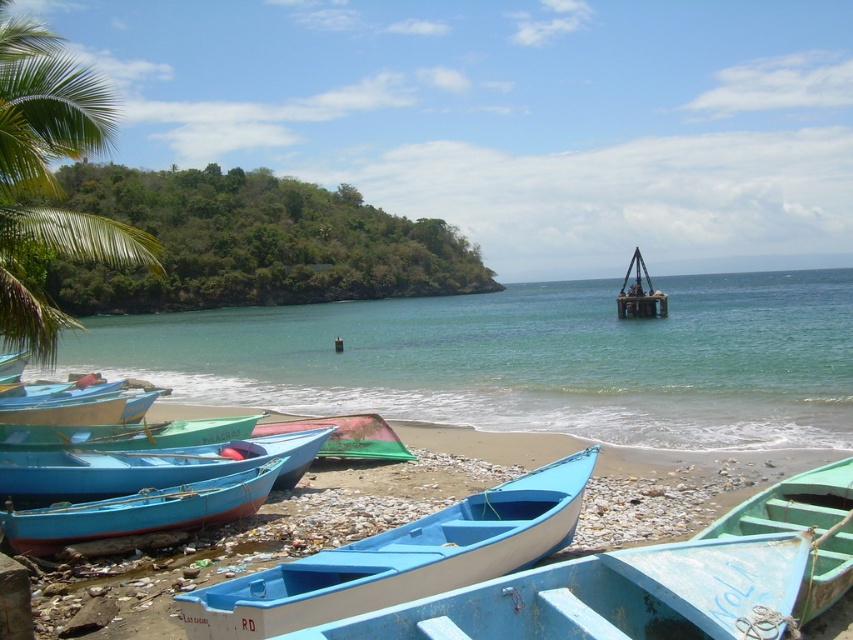
Question: In this image, where is matte blue canoe at lower left located relative to green matte canoe at center?

Choices:
 (A) left
 (B) right

Answer: (A)

Question: Which point is closer to the camera taking this photo?

Choices:
 (A) (308, 528)
 (B) (62, 141)
 (C) (595, 314)
 (D) (351, 433)

Answer: (A)

Question: Is light blue wooden canoe at center further to camera compared to green matte boat at lower right?

Choices:
 (A) no
 (B) yes

Answer: (A)

Question: Does matte blue canoe at lower left appear over green matte canoe at center?

Choices:
 (A) no
 (B) yes

Answer: (A)

Question: Among these objects, which one is nearest to the camera?

Choices:
 (A) green matte boat at lower right
 (B) blue painted wooden boat at lower left

Answer: (A)

Question: Which is farther from the blue plastic boats at lower left?

Choices:
 (A) matte blue canoe at center
 (B) matte blue canoe at lower left
 (C) green matte canoe at center
 (D) green leafy palm tree at upper left

Answer: (D)